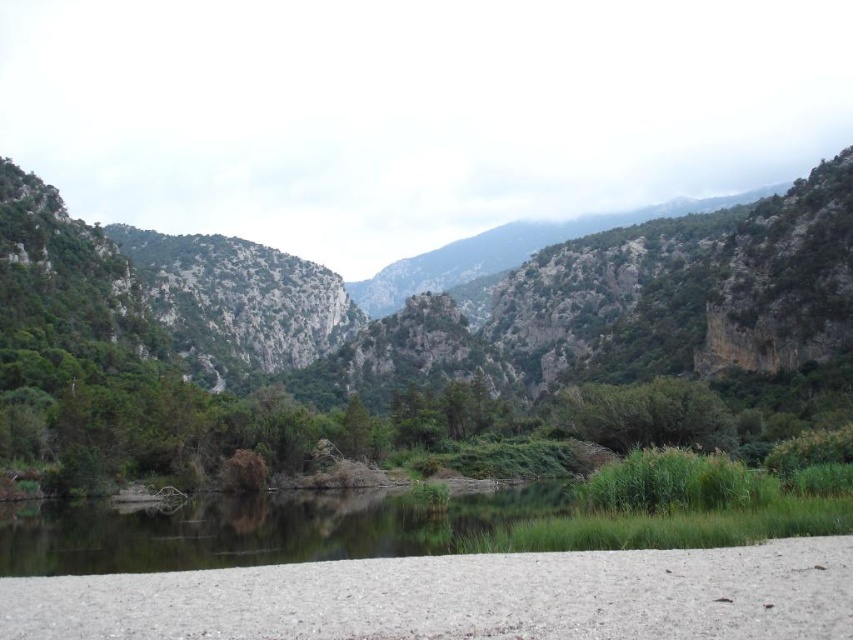
Question: Does white gravel at lower center appear over clear water at center?

Choices:
 (A) no
 (B) yes

Answer: (B)

Question: Is clear water at center positioned in front of green leafy bush at center?

Choices:
 (A) no
 (B) yes

Answer: (B)

Question: Which object is positioned closest to the clear water at center?

Choices:
 (A) white gravel at lower center
 (B) green leafy bush at center

Answer: (A)

Question: Considering the real-world distances, which object is closest to the clear water at center?

Choices:
 (A) green leafy bush at center
 (B) white gravel at lower center

Answer: (B)

Question: Does clear water at center come in front of green leafy bush at center?

Choices:
 (A) yes
 (B) no

Answer: (A)

Question: Considering the real-world distances, which object is closest to the clear water at center?

Choices:
 (A) green leafy bush at center
 (B) white gravel at lower center

Answer: (B)